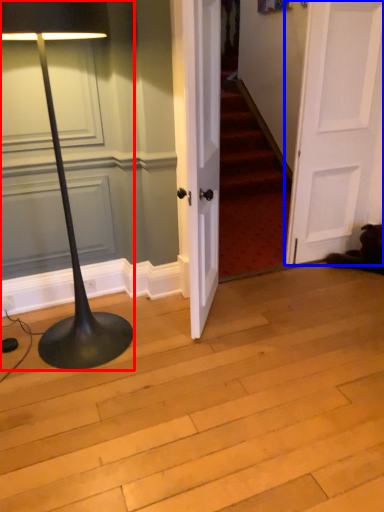
Question: Which object appears closest to the camera in this image, lamp (highlighted by a red box) or door (highlighted by a blue box)?

Choices:
 (A) lamp
 (B) door

Answer: (A)